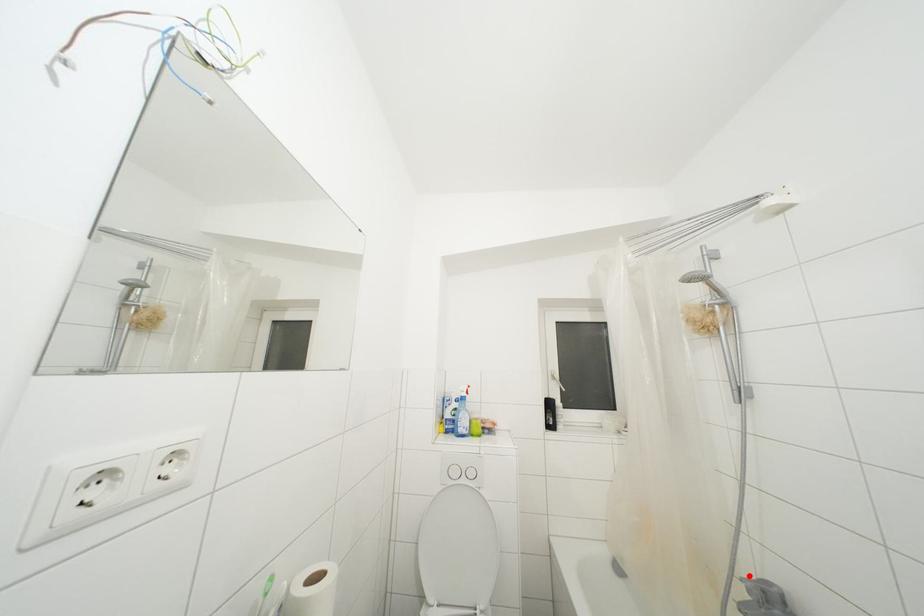
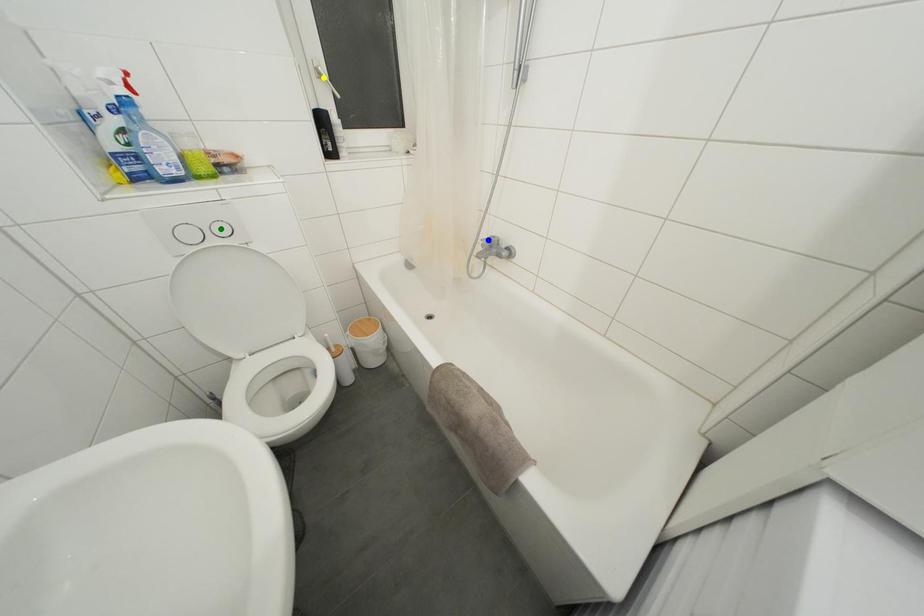
Question: I am providing you with two images of the same scene from different viewpoints. A red point is marked on the first image. You are given multiple points on the second image. Which mark in image 2 goes with the point in image 1?

Choices:
 (A) blue point
 (B) green point
 (C) yellow point

Answer: (A)